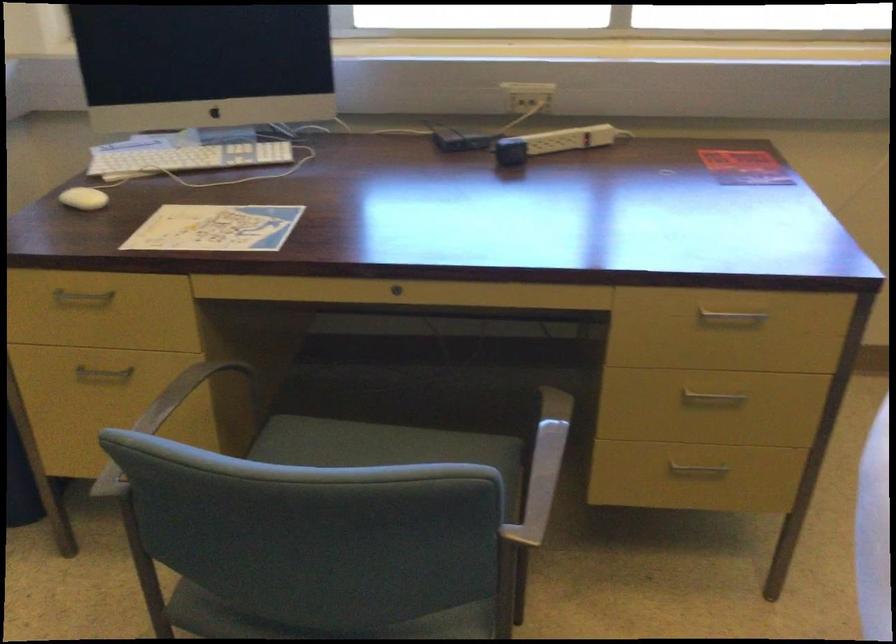
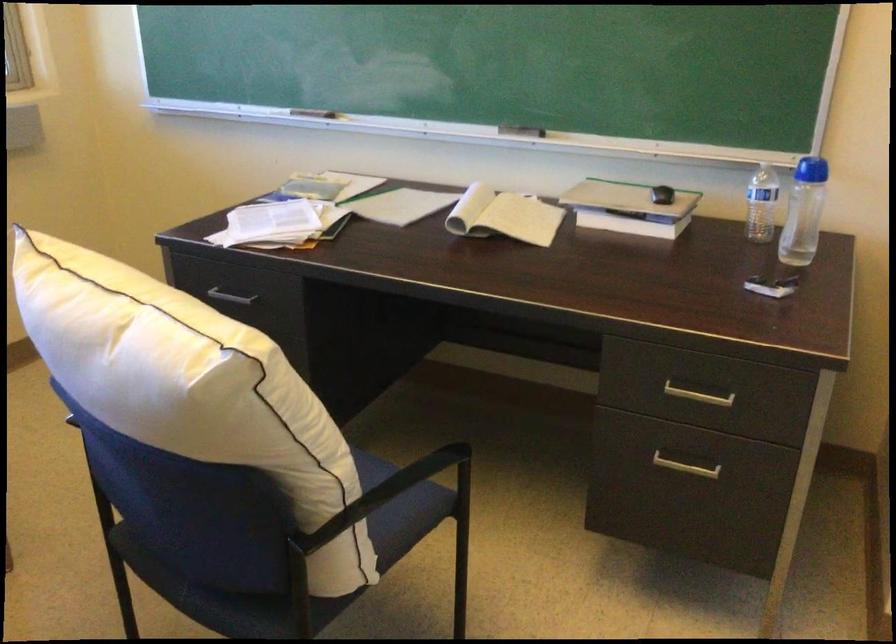
Question: Based on the continuous images, in which direction is the camera rotating? Reply with the corresponding letter.

Choices:
 (A) Left
 (B) Right
 (C) Up
 (D) Down

Answer: (B)